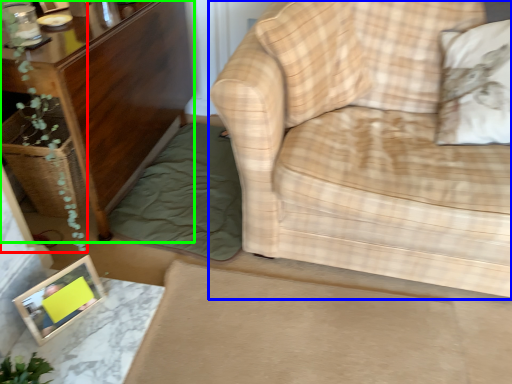
Question: Considering the real-world distances, which object is farthest from plant (highlighted by a red box)? studio couch (highlighted by a blue box) or furniture (highlighted by a green box)?

Choices:
 (A) studio couch
 (B) furniture

Answer: (A)